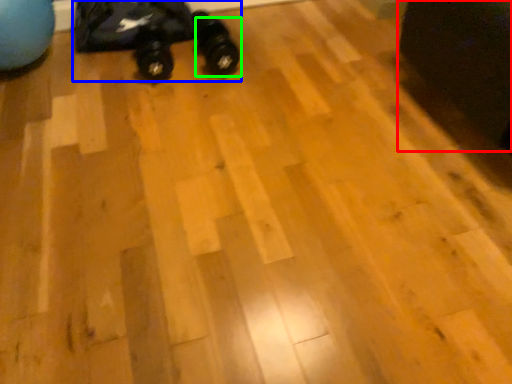
Question: Which object is positioned closest to swivel chair (highlighted by a red box)? Select from toy car (highlighted by a blue box) and footwear (highlighted by a green box).

Choices:
 (A) toy car
 (B) footwear

Answer: (B)